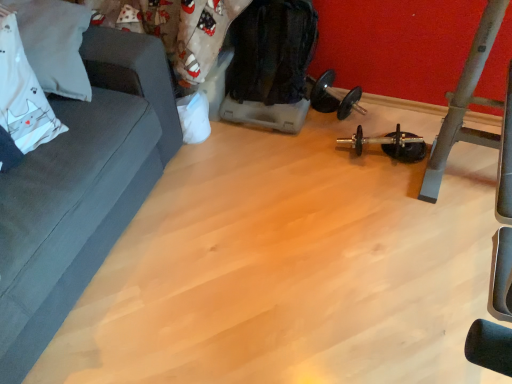
Question: Is black rubber dumbbell at center to the right of dark gray fabric couch at left from the viewer's perspective?

Choices:
 (A) yes
 (B) no

Answer: (A)

Question: Does black rubber dumbbell at center have a larger size compared to dark gray fabric couch at left?

Choices:
 (A) no
 (B) yes

Answer: (A)

Question: Is black rubber dumbbell at center positioned far away from dark gray fabric couch at left?

Choices:
 (A) no
 (B) yes

Answer: (B)

Question: Is black rubber dumbbell at center surrounding dark gray fabric couch at left?

Choices:
 (A) yes
 (B) no

Answer: (B)

Question: Is dark gray fabric couch at left at the back of black rubber dumbbell at center?

Choices:
 (A) no
 (B) yes

Answer: (A)

Question: Does black rubber dumbbell at center have a lesser width compared to dark gray fabric couch at left?

Choices:
 (A) yes
 (B) no

Answer: (A)

Question: Is white fabric pillow at upper left directly adjacent to dark gray fabric couch at left?

Choices:
 (A) no
 (B) yes

Answer: (A)

Question: Does white fabric pillow at upper left have a smaller size compared to dark gray fabric couch at left?

Choices:
 (A) yes
 (B) no

Answer: (A)

Question: Does white fabric pillow at upper left have a greater width compared to dark gray fabric couch at left?

Choices:
 (A) no
 (B) yes

Answer: (A)

Question: Can we say white fabric pillow at upper left lies outside dark gray fabric couch at left?

Choices:
 (A) no
 (B) yes

Answer: (A)

Question: Does white fabric pillow at upper left have a greater height compared to dark gray fabric couch at left?

Choices:
 (A) yes
 (B) no

Answer: (B)

Question: Is white fabric pillow at upper left shorter than dark gray fabric couch at left?

Choices:
 (A) yes
 (B) no

Answer: (A)

Question: Would you consider black rubber dumbbell at center to be distant from white fabric pillow at upper left?

Choices:
 (A) no
 (B) yes

Answer: (B)